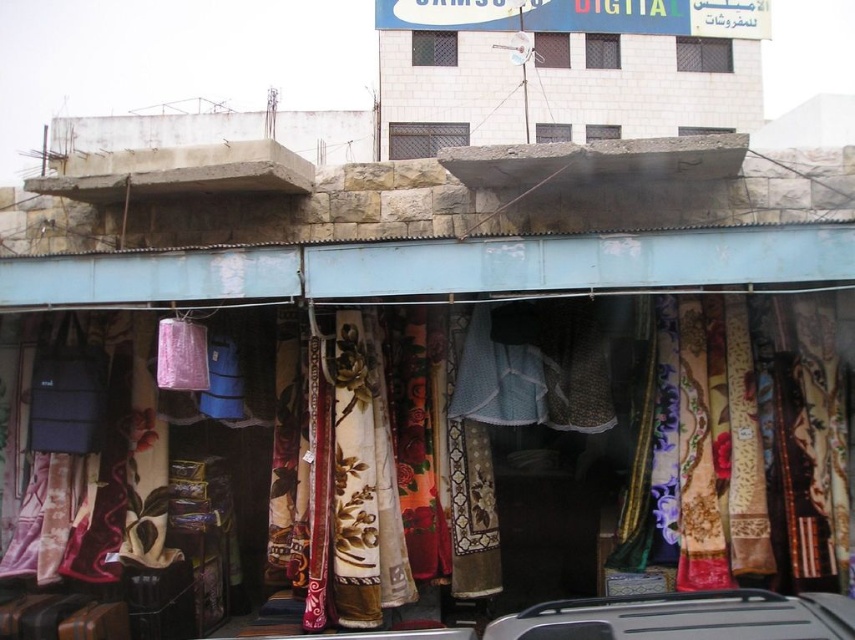
Can you confirm if floral fabric at center is positioned below silver metallic car at lower center?

Actually, floral fabric at center is above silver metallic car at lower center.

Measure the distance from floral fabric at center to silver metallic car at lower center.

A distance of 2.61 meters exists between floral fabric at center and silver metallic car at lower center.

Where is `floral fabric at center`? This screenshot has height=640, width=855. floral fabric at center is located at coordinates (759, 445).